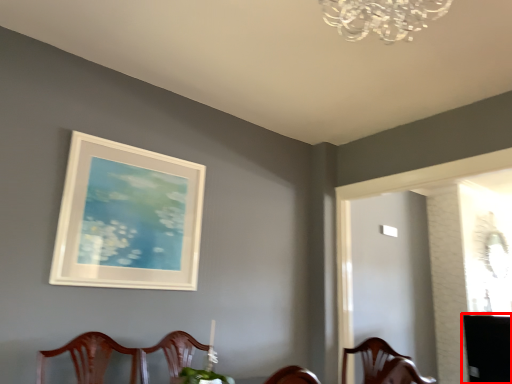
Question: From the image's perspective, what is the correct spatial positioning of table (annotated by the red box) in reference to picture frame?

Choices:
 (A) below
 (B) above

Answer: (A)